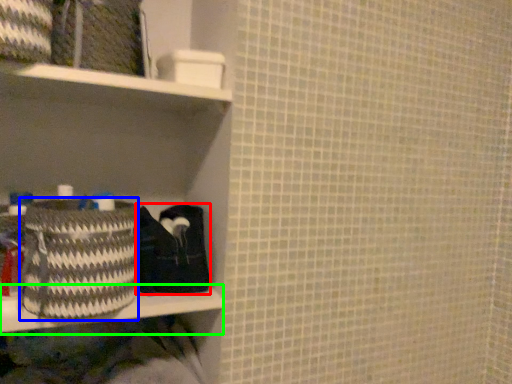
Question: Which object is positioned closest to material (highlighted by a red box)? Select from basket (highlighted by a blue box) and ledge (highlighted by a green box).

Choices:
 (A) basket
 (B) ledge

Answer: (B)